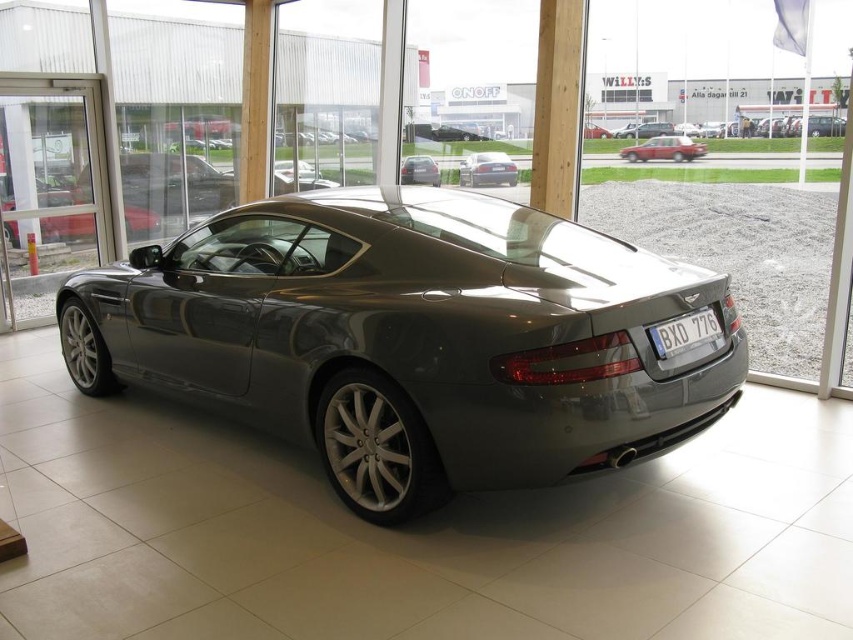
You are a delivery person trying to park a new car in the showroom. The entrance is through the sliding doors. You see the satin metallic car at center and the satin silver sedan at center. Which car is taller and might block the entrance if moved?

The satin metallic car at center is taller than the satin silver sedan at center, so moving it might block the entrance.

You are a delivery person who needs to park a 2.5 meter wide delivery van in the parking lot outside the showroom. The van must be parked in a spot that is not directly in front of the satin metallic car at center. Based on the coordinates provided, can you determine if the van will fit in the available parking spots?

The satin metallic car at center is positioned at coordinates point [415,337]. Since the van must avoid being directly in front of it and parking spots are typically standardized in size, the van will fit as long as the parking spots are at least 2.5 meters wide, which is standard for most commercial parking areas.